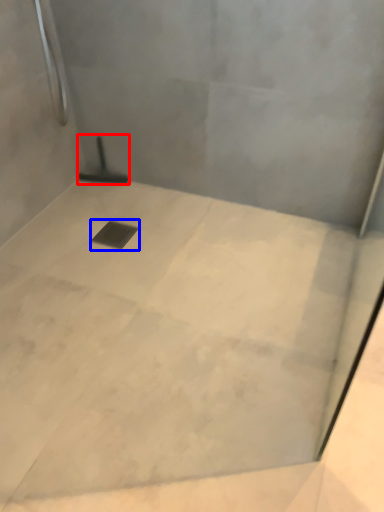
Question: Which point is closer to the camera, shower (highlighted by a red box) or drain (highlighted by a blue box)?

Choices:
 (A) shower
 (B) drain

Answer: (B)